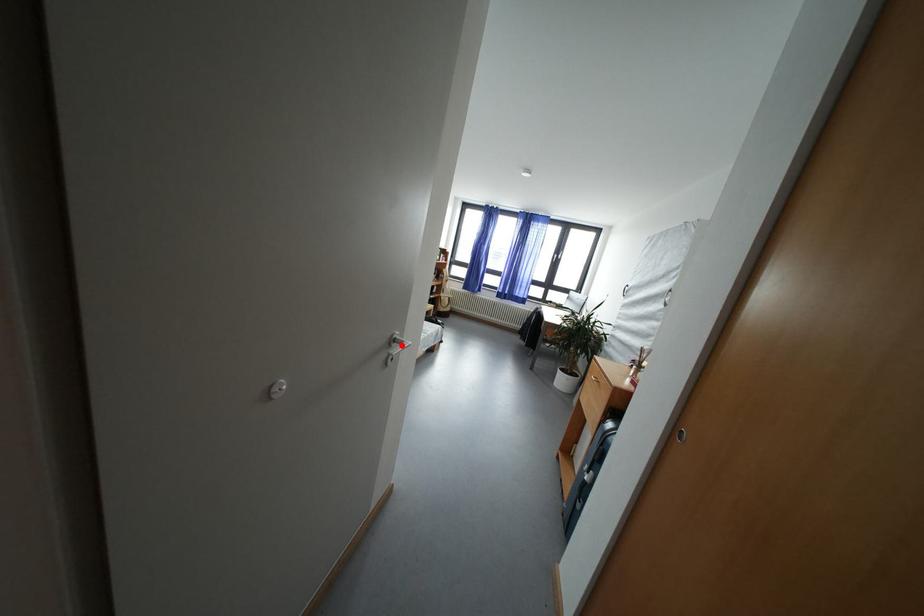
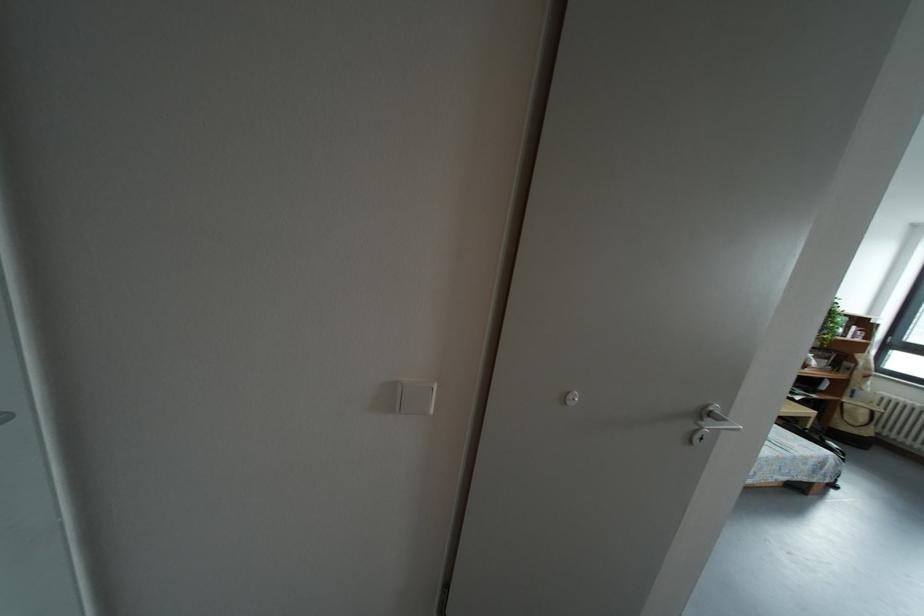
The point at the highlighted location is marked in the first image. Where is the corresponding point in the second image?

(718, 419)